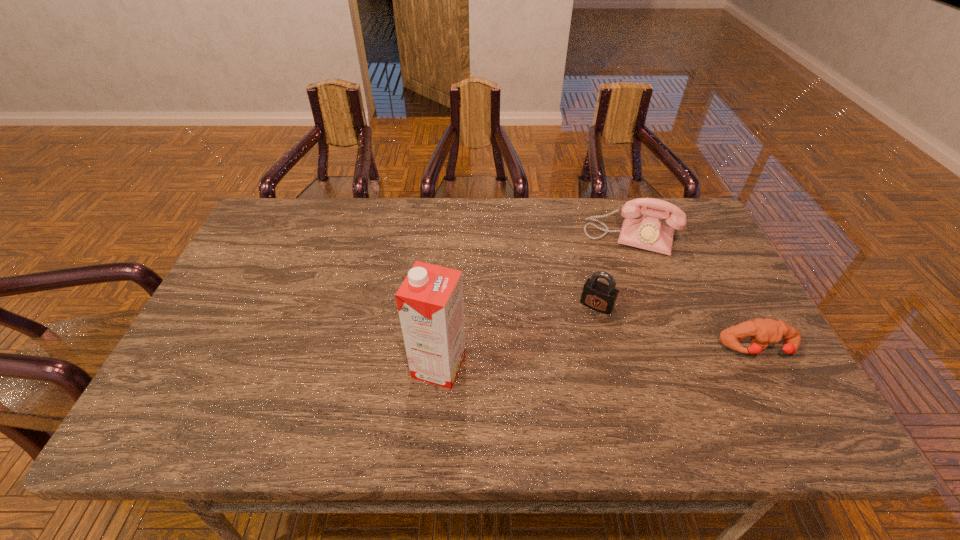
What are the coordinates of `free point between the puncher and the leftmost object` in the screenshot? It's located at (599, 357).

Locate an element on the screen. This screenshot has height=540, width=960. free spot between the second tallest object and the tallest object is located at coordinates (535, 302).

Image resolution: width=960 pixels, height=540 pixels. I want to click on free space that is in between the puncher and the tallest object, so click(x=599, y=357).

The width and height of the screenshot is (960, 540). I want to click on vacant point located between the tallest object and the second shortest object, so click(x=517, y=336).

Where is `vacant point located between the tallest object and the telephone`? vacant point located between the tallest object and the telephone is located at coordinates (535, 302).

Point out which object is positioned as the nearest to the farthest object. Please provide its 2D coordinates. Your answer should be formatted as a tuple, i.e. [(x, y)], where the tuple contains the x and y coordinates of a point satisfying the conditions above.

[(596, 295)]

Identify which object is the third nearest to the telephone. Please provide its 2D coordinates. Your answer should be formatted as a tuple, i.e. [(x, y)], where the tuple contains the x and y coordinates of a point satisfying the conditions above.

[(430, 300)]

Find the location of `vacant region that satisfies the following two spatial constraints: 1. on the back side of the carton; 2. on the left side of the telephone`. vacant region that satisfies the following two spatial constraints: 1. on the back side of the carton; 2. on the left side of the telephone is located at coordinates (449, 238).

Where is `free point that satisfies the following two spatial constraints: 1. on the back side of the farthest object; 2. on the right side of the carton`? This screenshot has height=540, width=960. free point that satisfies the following two spatial constraints: 1. on the back side of the farthest object; 2. on the right side of the carton is located at coordinates point(449,238).